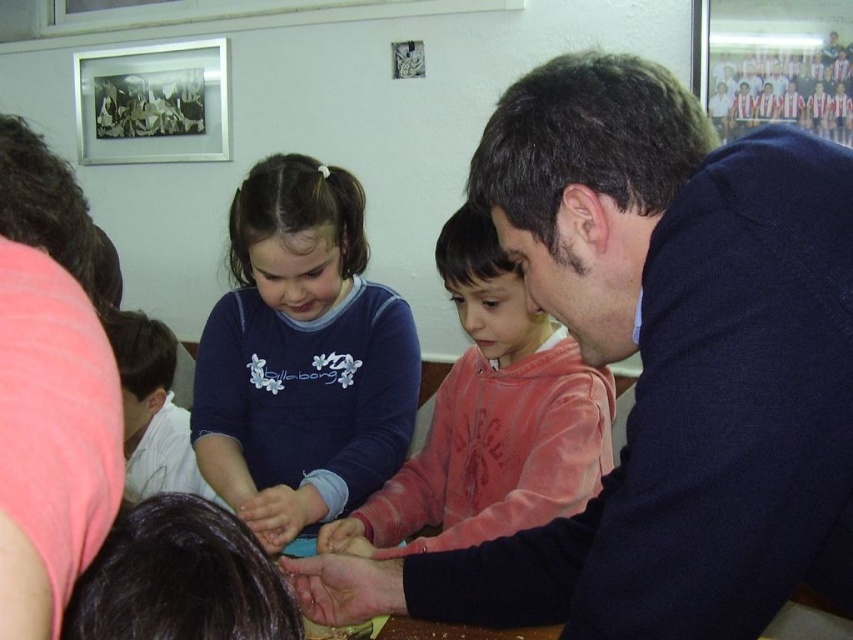
Which is more to the left, dark blue sweater at center or pink fleece sweater at center?

Positioned to the left is pink fleece sweater at center.

Does point (820, 196) come farther from viewer compared to point (444, 278)?

No, it is not.

I want to click on dark blue sweater at center, so click(x=660, y=368).

Based on the photo, does dark blue sweater at center appear over matte blue shirt at center?

No, dark blue sweater at center is not above matte blue shirt at center.

Is point (643, 426) positioned after point (329, 307)?

No, (643, 426) is closer to viewer.

Is point (780, 324) closer to camera compared to point (299, 422)?

Yes, it is in front of point (299, 422).

The image size is (853, 640). What are the coordinates of `dark blue sweater at center` in the screenshot? It's located at (660, 368).

Which is more to the left, dark blue sweater at center or pink fabric shirt at upper left?

pink fabric shirt at upper left is more to the left.

Does dark blue sweater at center appear over pink fabric shirt at upper left?

Incorrect, dark blue sweater at center is not positioned above pink fabric shirt at upper left.

Does point (825, 160) come behind point (47, 442)?

Yes, point (825, 160) is farther from viewer.

This screenshot has width=853, height=640. I want to click on dark blue sweater at center, so click(x=660, y=368).